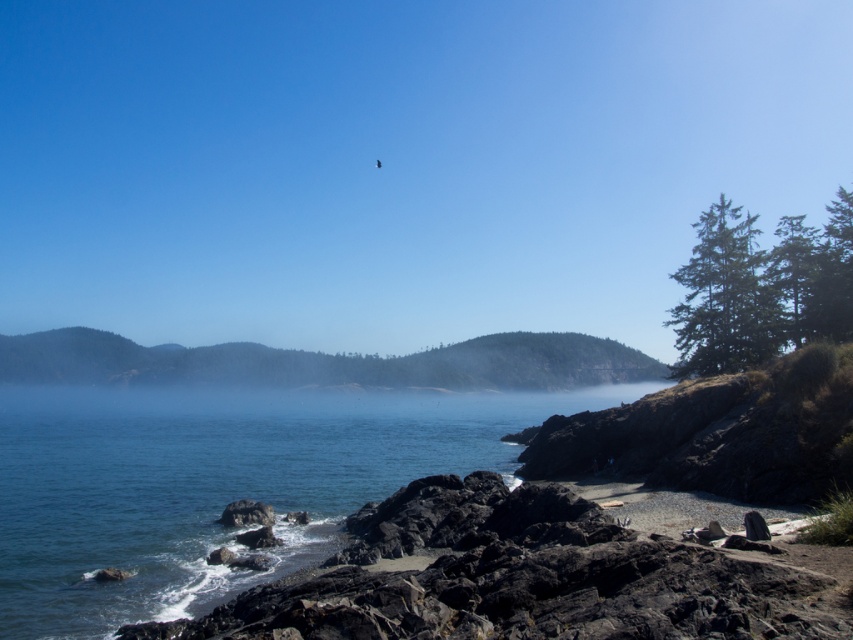
Question: Is clear blue water at center wider than volcanic rock beach at lower right?

Choices:
 (A) yes
 (B) no

Answer: (A)

Question: Is clear blue water at center below volcanic rock beach at lower right?

Choices:
 (A) yes
 (B) no

Answer: (A)

Question: Which point appears farthest from the camera in this image?

Choices:
 (A) (360, 392)
 (B) (445, 561)

Answer: (A)

Question: Is clear blue water at center below volcanic rock beach at lower right?

Choices:
 (A) yes
 (B) no

Answer: (A)